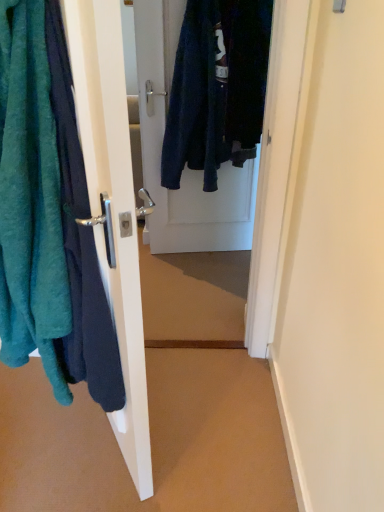
Where is `free point to the left of matte white door handle at left, placed as the second door when sorted from right to left`? Image resolution: width=384 pixels, height=512 pixels. free point to the left of matte white door handle at left, placed as the second door when sorted from right to left is located at coordinates (43, 425).